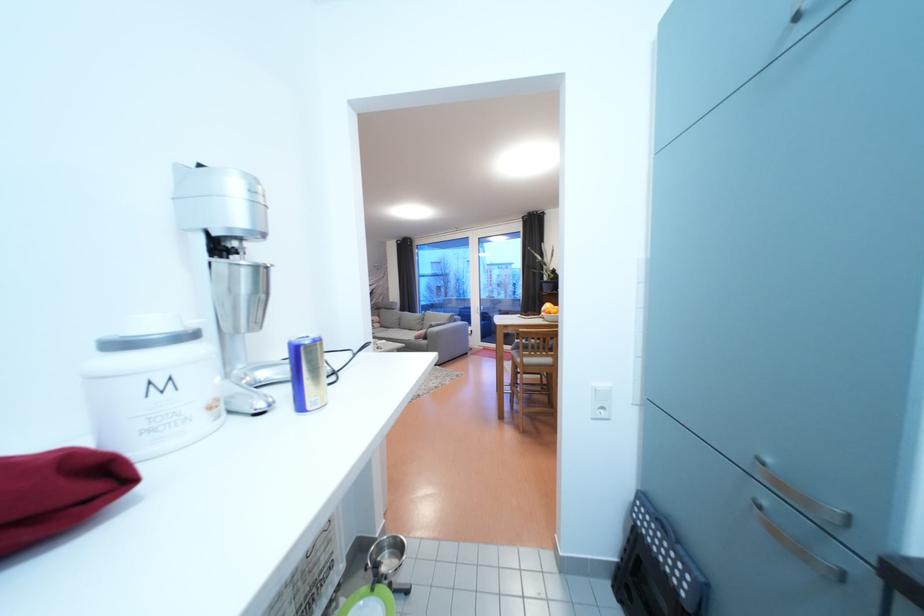
At what (x,y) coordinates should I click in order to perform the action: click on sofa sitting surface. Please return your answer as a coordinate pair (x, y). Looking at the image, I should click on (393, 334).